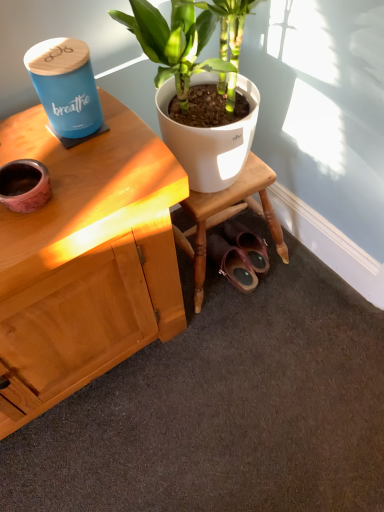
Where is `leather/matte sandals at lower center`? This screenshot has width=384, height=512. leather/matte sandals at lower center is located at coordinates (232, 263).

This screenshot has width=384, height=512. What do you see at coordinates (232, 263) in the screenshot?
I see `leather/matte sandals at lower center` at bounding box center [232, 263].

The height and width of the screenshot is (512, 384). What do you see at coordinates (24, 185) in the screenshot? I see `pink marble flowerpot at left` at bounding box center [24, 185].

In order to face pink marble flowerpot at left, should I rotate leftwards or rightwards?

Answer: It's best to rotate left around 21.396 degrees.

I want to click on pink marble flowerpot at left, so click(24, 185).

Image resolution: width=384 pixels, height=512 pixels. Find the location of `leather/matte sandals at lower center`. leather/matte sandals at lower center is located at coordinates (232, 263).

Does pink marble flowerpot at left appear on the right side of leather/matte sandals at lower center?

No, pink marble flowerpot at left is not to the right of leather/matte sandals at lower center.

Which is behind, pink marble flowerpot at left or leather/matte sandals at lower center?

leather/matte sandals at lower center is further away from the camera.

Does point (25, 202) appear closer or farther from the camera than point (248, 265)?

Clearly, point (25, 202) is closer to the camera than point (248, 265).

From the image's perspective, which one is positioned higher, pink marble flowerpot at left or leather/matte sandals at lower center?

pink marble flowerpot at left, from the image's perspective.

From the picture: From a real-world perspective, between pink marble flowerpot at left and leather/matte sandals at lower center, who is vertically higher?

From a 3D spatial view, pink marble flowerpot at left is above.

Between pink marble flowerpot at left and leather/matte sandals at lower center, which one has larger width?

Wider between the two is leather/matte sandals at lower center.

Considering the relative sizes of pink marble flowerpot at left and leather/matte sandals at lower center in the image provided, is pink marble flowerpot at left taller than leather/matte sandals at lower center?

No.

Is pink marble flowerpot at left smaller than leather/matte sandals at lower center?

Yes.

Would you say leather/matte sandals at lower center is part of pink marble flowerpot at left's contents?

No, leather/matte sandals at lower center is not a part of pink marble flowerpot at left.

Would you consider pink marble flowerpot at left to be distant from leather/matte sandals at lower center?

No, pink marble flowerpot at left is not far from leather/matte sandals at lower center.

Is pink marble flowerpot at left facing away from leather/matte sandals at lower center?

No, pink marble flowerpot at left is not facing away from leather/matte sandals at lower center.

Can you tell me how much pink marble flowerpot at left and leather/matte sandals at lower center differ in facing direction?

pink marble flowerpot at left and leather/matte sandals at lower center are facing 5.71 degrees away from each other.

Measure the distance between pink marble flowerpot at left and leather/matte sandals at lower center.

pink marble flowerpot at left is 75.21 centimeters away from leather/matte sandals at lower center.

Locate an element on the screen. The height and width of the screenshot is (512, 384). flowerpot on the left side of leather/matte sandals at lower center is located at coordinates (24, 185).

Is leather/matte sandals at lower center at the left side of pink marble flowerpot at left?

Incorrect, leather/matte sandals at lower center is not on the left side of pink marble flowerpot at left.

Who is more distant, leather/matte sandals at lower center or pink marble flowerpot at left?

Positioned behind is leather/matte sandals at lower center.

Is point (231, 263) closer to camera compared to point (22, 188)?

No, (231, 263) is further to viewer.

From the image's perspective, between leather/matte sandals at lower center and pink marble flowerpot at left, which one is located above?

Answer: pink marble flowerpot at left appears higher in the image.

From a real-world perspective, who is located higher, leather/matte sandals at lower center or pink marble flowerpot at left?

In real-world perspective, pink marble flowerpot at left is above.

Considering the relative sizes of leather/matte sandals at lower center and pink marble flowerpot at left in the image provided, is leather/matte sandals at lower center wider than pink marble flowerpot at left?

Yes, leather/matte sandals at lower center is wider than pink marble flowerpot at left.

Who is taller, leather/matte sandals at lower center or pink marble flowerpot at left?

leather/matte sandals at lower center is taller.

Considering the relative sizes of leather/matte sandals at lower center and pink marble flowerpot at left in the image provided, is leather/matte sandals at lower center smaller than pink marble flowerpot at left?

Actually, leather/matte sandals at lower center might be larger than pink marble flowerpot at left.

Is pink marble flowerpot at left inside leather/matte sandals at lower center?

No, leather/matte sandals at lower center does not contain pink marble flowerpot at left.

Does leather/matte sandals at lower center touch pink marble flowerpot at left?

leather/matte sandals at lower center is not next to pink marble flowerpot at left, and they're not touching.

Is leather/matte sandals at lower center facing towards pink marble flowerpot at left?

No.

What are the coordinates of `flowerpot above the leather/matte sandals at lower center (from a real-world perspective)` in the screenshot? It's located at (24, 185).

The width and height of the screenshot is (384, 512). Find the location of `footwear on the right of pink marble flowerpot at left`. footwear on the right of pink marble flowerpot at left is located at coordinates [x=232, y=263].

Where is `footwear that is behind the pink marble flowerpot at left`? footwear that is behind the pink marble flowerpot at left is located at coordinates (232, 263).